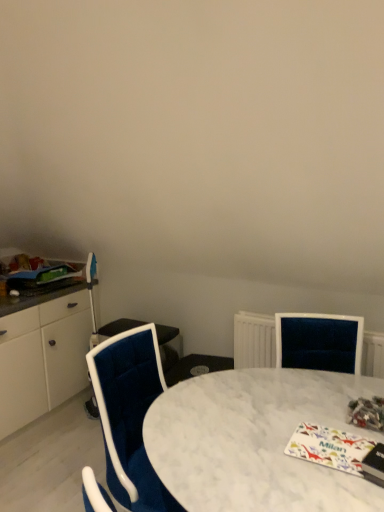
Locate an element on the screen. This screenshot has width=384, height=512. vacant region above white glossy magazine at lower right, the 2th magazine when ordered from left to right (from a real-world perspective) is located at coordinates (328, 440).